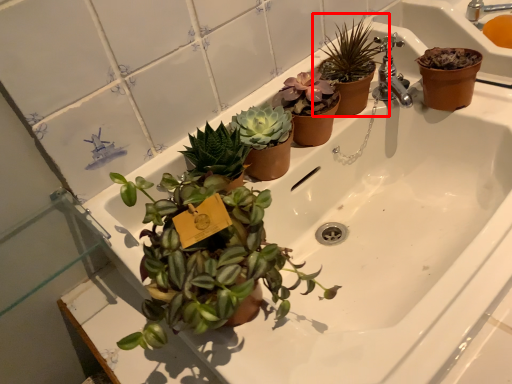
Question: Observing the image, what is the correct spatial positioning of houseplant (annotated by the red box) in reference to sink?

Choices:
 (A) right
 (B) left

Answer: (B)